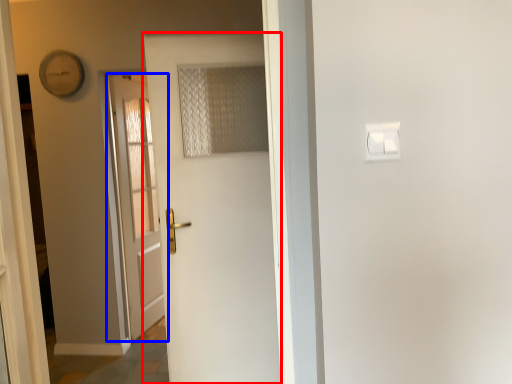
Question: Which object appears farthest to the camera in this image, door (highlighted by a red box) or door (highlighted by a blue box)?

Choices:
 (A) door
 (B) door

Answer: (B)